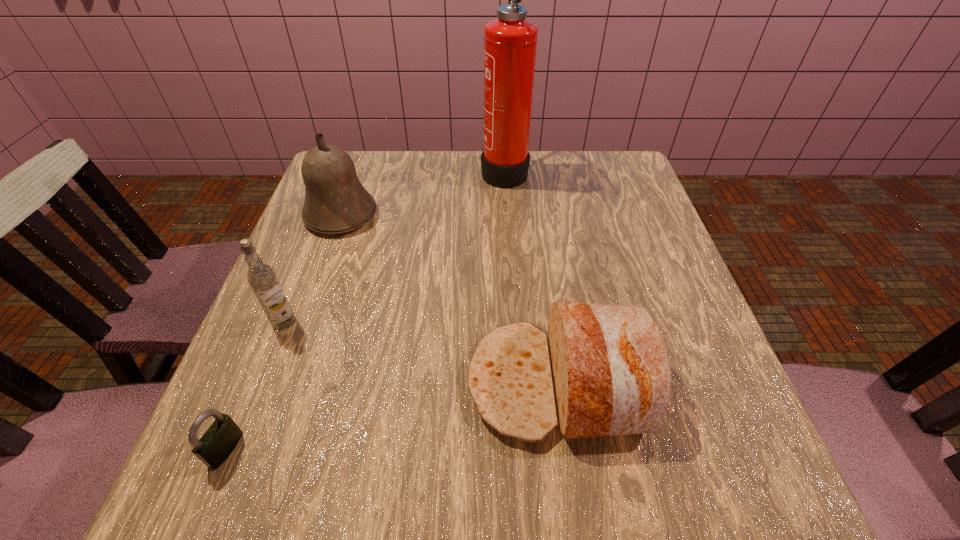
Identify the location of free spot between the vodka and the tallest object. (395, 246).

Identify the location of vacant space that's between the farthest object and the padlock. (365, 310).

I want to click on free space between the vodka and the bread, so pos(421,352).

Where is `vacant space that's between the bell and the fire extinguisher`? This screenshot has height=540, width=960. vacant space that's between the bell and the fire extinguisher is located at coordinates [422, 193].

Locate an element on the screen. free area in between the bell and the second shortest object is located at coordinates (450, 299).

Locate an element on the screen. Image resolution: width=960 pixels, height=540 pixels. free space that is in between the fourth nearest object and the padlock is located at coordinates (283, 332).

The width and height of the screenshot is (960, 540). Identify the location of free space between the fire extinguisher and the padlock. (365, 310).

Locate an element on the screen. The width and height of the screenshot is (960, 540). vacant area that lies between the second shortest object and the tallest object is located at coordinates (532, 276).

Where is `vacant space that's between the bell and the farthest object`? This screenshot has width=960, height=540. vacant space that's between the bell and the farthest object is located at coordinates (422, 193).

The height and width of the screenshot is (540, 960). Identify the location of unoccupied area between the second shortest object and the vodka. (421, 352).